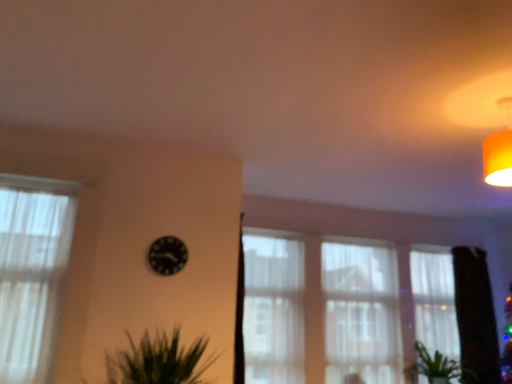
Question: Is black glossy clock at center inside or outside of white sheer curtain at right, the fourth curtain in the left-to-right sequence?

Choices:
 (A) outside
 (B) inside

Answer: (A)

Question: From a real-world perspective, is black glossy clock at center physically located above or below white sheer curtain at right, the fourth curtain in the left-to-right sequence?

Choices:
 (A) above
 (B) below

Answer: (A)

Question: Which object is the closest to the white sheer curtain at right, arranged as the 1th curtain when viewed from the back?

Choices:
 (A) green leafy plant at lower right
 (B) white sheer curtain at center, which is the 3th curtain in left-to-right order
 (C) white sheer curtain at center, which is counted as the second curtain, starting from the front
 (D) black glossy clock at center
 (E) white sheer curtain at left, marked as the 1th curtain in a left-to-right arrangement

Answer: (A)

Question: Which object is the closest to the black glossy clock at center?

Choices:
 (A) white sheer curtain at center, which is the 3th curtain from front to back
 (B) white sheer curtain at right, the 1th curtain from the right
 (C) green matte tree at right
 (D) orange fabric lampshade at upper right
 (E) green leafy plant at lower right

Answer: (D)